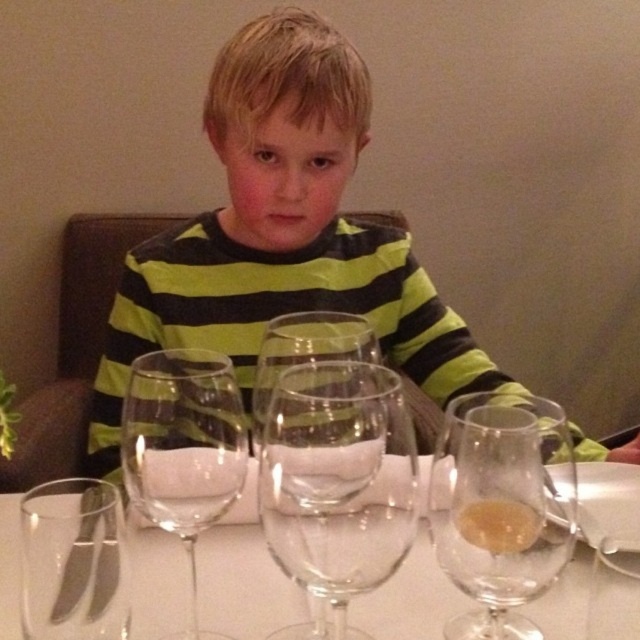
Question: Which point is farther to the camera?

Choices:
 (A) (144, 422)
 (B) (481, 524)
 (C) (426, 627)
 (D) (440, 340)

Answer: (D)

Question: Which point appears closest to the camera in this image?

Choices:
 (A) (326, 32)
 (B) (372, 381)
 (C) (176, 538)
 (D) (490, 396)

Answer: (B)

Question: Where is transparent glass wine glass at center located in relation to transparent glass wine glass at lower left in the image?

Choices:
 (A) below
 (B) above

Answer: (A)

Question: Which point is closer to the camera?

Choices:
 (A) (305, 531)
 (B) (125, 369)
 (C) (138, 371)

Answer: (A)

Question: Does transparent glass wine glass at center lie in front of translucent glass wine glass at center?

Choices:
 (A) no
 (B) yes

Answer: (B)

Question: Can you confirm if translucent glass wine glass at center is positioned to the right of transparent glass wine glass at lower left?

Choices:
 (A) no
 (B) yes

Answer: (B)